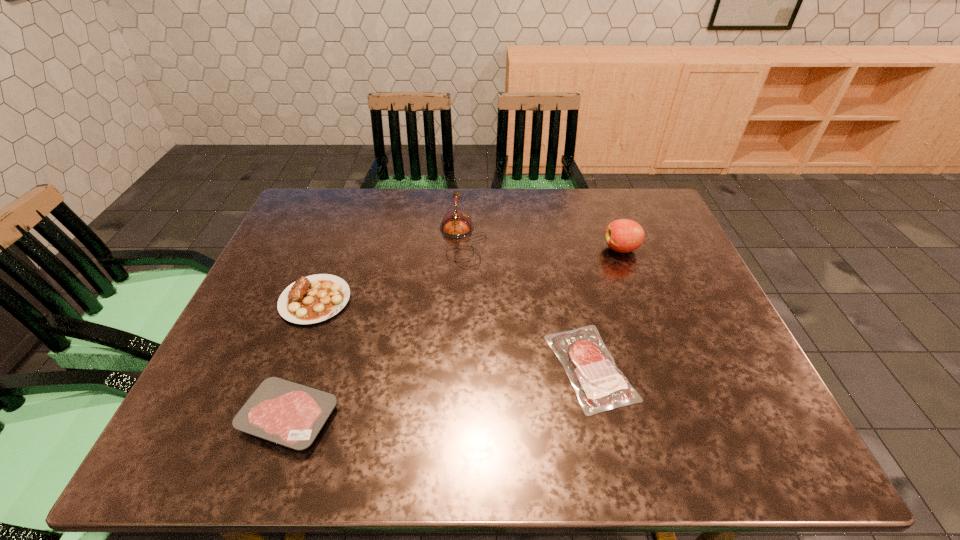
The width and height of the screenshot is (960, 540). I want to click on object that is positioned at the right edge, so click(x=624, y=235).

The image size is (960, 540). I want to click on object that is at the near left corner, so click(291, 414).

Find the location of a particular element. Image resolution: width=960 pixels, height=540 pixels. vacant space at the far edge is located at coordinates (570, 208).

Where is `vacant space at the near edge of the desktop`? The image size is (960, 540). vacant space at the near edge of the desktop is located at coordinates (516, 455).

You are a GUI agent. You are given a task and a screenshot of the screen. Output one action in this format:
    pyautogui.click(x=<x>, y=<y>)
    Task: Click on the vacant area at the left edge of the desktop
    The height and width of the screenshot is (540, 960).
    Given the screenshot: What is the action you would take?
    pos(266,306)

You are a GUI agent. You are given a task and a screenshot of the screen. Output one action in this format:
    pyautogui.click(x=<x>, y=<y>)
    Task: Click on the vacant space at the right edge of the desktop
    
    Given the screenshot: What is the action you would take?
    pyautogui.click(x=662, y=319)

In the image, there is a desktop. Identify the location of vacant space at the near left corner. The width and height of the screenshot is (960, 540). (198, 444).

Where is `vacant region between the second object from right to left and the telephone`? This screenshot has width=960, height=540. vacant region between the second object from right to left and the telephone is located at coordinates (526, 303).

The image size is (960, 540). I want to click on free space between the rightmost object and the second object from right to left, so click(606, 308).

Image resolution: width=960 pixels, height=540 pixels. Identify the location of empty space between the third object from right to left and the rightmost object. (542, 244).